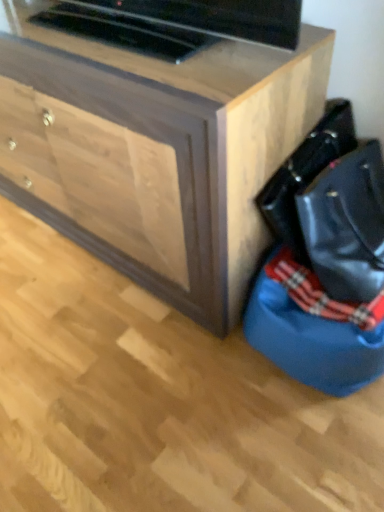
Question: Is black leather messenger bag at lower right looking in the opposite direction of blue fabric bean bag at lower right?

Choices:
 (A) yes
 (B) no

Answer: (B)

Question: Is blue fabric bean bag at lower right located within black leather messenger bag at lower right?

Choices:
 (A) no
 (B) yes

Answer: (A)

Question: Does black leather messenger bag at lower right appear on the left side of blue fabric bean bag at lower right?

Choices:
 (A) yes
 (B) no

Answer: (A)

Question: Is black leather messenger bag at lower right further to the viewer compared to blue fabric bean bag at lower right?

Choices:
 (A) yes
 (B) no

Answer: (B)

Question: Does black leather messenger bag at lower right appear on the right side of blue fabric bean bag at lower right?

Choices:
 (A) no
 (B) yes

Answer: (A)

Question: From the image's perspective, is black leather messenger bag at lower right under blue fabric bean bag at lower right?

Choices:
 (A) yes
 (B) no

Answer: (B)

Question: Are wooden chest of drawers at center and blue fabric bean bag at lower right far apart?

Choices:
 (A) no
 (B) yes

Answer: (A)

Question: From a real-world perspective, is wooden chest of drawers at center physically below blue fabric bean bag at lower right?

Choices:
 (A) no
 (B) yes

Answer: (A)

Question: Is wooden chest of drawers at center positioned before blue fabric bean bag at lower right?

Choices:
 (A) no
 (B) yes

Answer: (B)

Question: Is wooden chest of drawers at center further to the viewer compared to blue fabric bean bag at lower right?

Choices:
 (A) no
 (B) yes

Answer: (A)

Question: Can you confirm if wooden chest of drawers at center is shorter than blue fabric bean bag at lower right?

Choices:
 (A) no
 (B) yes

Answer: (A)

Question: Considering the relative sizes of wooden chest of drawers at center and blue fabric bean bag at lower right in the image provided, is wooden chest of drawers at center smaller than blue fabric bean bag at lower right?

Choices:
 (A) yes
 (B) no

Answer: (B)

Question: Considering the relative positions of blue fabric bean bag at lower right and wooden chest of drawers at center in the image provided, is blue fabric bean bag at lower right behind wooden chest of drawers at center?

Choices:
 (A) yes
 (B) no

Answer: (A)